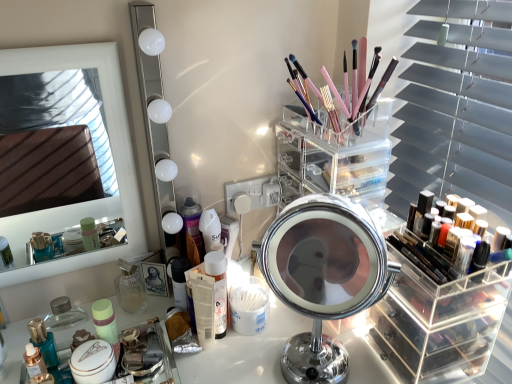
Locate an element on the screen. This screenshot has height=384, width=512. free point above chrome/metallic mirror at center, marked as the third mirror in a left-to-right arrangement (from a real-world perspective) is located at coordinates (323, 215).